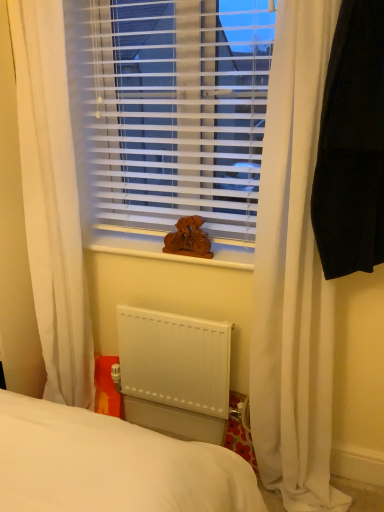
Question: Choose the correct answer: Is wooden statue at center inside white plastic blinds at center or outside it?

Choices:
 (A) inside
 (B) outside

Answer: (B)

Question: Is point (x=187, y=216) closer or farther from the camera than point (x=99, y=54)?

Choices:
 (A) closer
 (B) farther

Answer: (A)

Question: Considering the real-world distances, which object is closest to the wooden statue at center?

Choices:
 (A) black fabric at right, marked as the first curtain in a right-to-left arrangement
 (B) wooden statue at center
 (C) white fabric curtain at left, which ranks as the 1th curtain in left-to-right order
 (D) white plastic blinds at center
 (E) white matte radiator at lower center

Answer: (B)

Question: Which is farther from the white plastic blinds at center?

Choices:
 (A) white fabric curtain at left, which ranks as the 1th curtain in left-to-right order
 (B) black fabric at right, marked as the first curtain in a right-to-left arrangement
 (C) wooden statue at center
 (D) white matte radiator at lower center
 (E) wooden statue at center

Answer: (D)